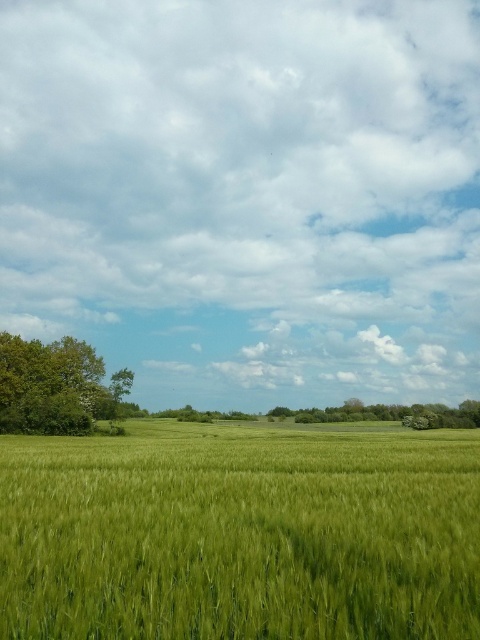
Question: Does green grassy wheat field at center lie behind green leafy tree at left?

Choices:
 (A) no
 (B) yes

Answer: (A)

Question: Which of these objects is positioned farthest from the green grassy wheat field at center?

Choices:
 (A) green leafy tree at center
 (B) cloudy sky at upper center

Answer: (B)

Question: Which object appears farthest from the camera in this image?

Choices:
 (A) green grassy wheat field at center
 (B) cloudy sky at upper center

Answer: (B)

Question: Is cloudy sky at upper center behind green grassy wheat field at center?

Choices:
 (A) yes
 (B) no

Answer: (A)

Question: Is cloudy sky at upper center to the left of green grassy wheat field at center from the viewer's perspective?

Choices:
 (A) yes
 (B) no

Answer: (A)

Question: Which of the following is the farthest from the observer?

Choices:
 (A) (47, 474)
 (B) (134, 3)

Answer: (B)